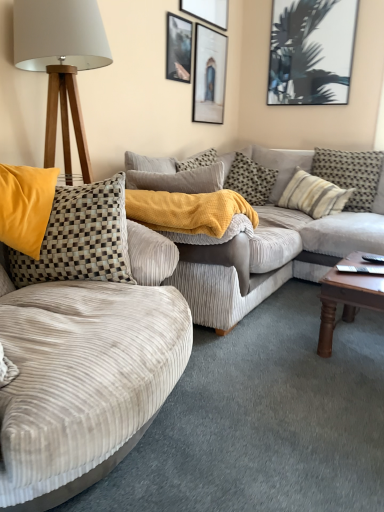
Question: Does striped fabric pillow at right, the 5th pillow from the left, have a larger size compared to striped fabric pillow at center, placed as the 4th pillow when sorted from left to right?

Choices:
 (A) yes
 (B) no

Answer: (A)

Question: From a real-world perspective, does striped fabric pillow at right, the 5th pillow from the left, sit lower than striped fabric pillow at center, which ranks as the 2th pillow in right-to-left order?

Choices:
 (A) yes
 (B) no

Answer: (B)

Question: From the image's perspective, is striped fabric pillow at right, the 5th pillow from the left, above striped fabric pillow at center, which ranks as the 2th pillow in right-to-left order?

Choices:
 (A) no
 (B) yes

Answer: (B)

Question: Is striped fabric pillow at right, the 5th pillow from the left, aimed at striped fabric pillow at center, which ranks as the 2th pillow in right-to-left order?

Choices:
 (A) yes
 (B) no

Answer: (A)

Question: Does striped fabric pillow at right, marked as the first pillow in a right-to-left arrangement, have a greater width compared to striped fabric pillow at center, placed as the 4th pillow when sorted from left to right?

Choices:
 (A) yes
 (B) no

Answer: (A)

Question: Is striped fabric pillow at right, marked as the first pillow in a right-to-left arrangement, beside striped fabric pillow at center, placed as the 4th pillow when sorted from left to right?

Choices:
 (A) yes
 (B) no

Answer: (B)

Question: Is metallic silver picture frame at upper center, the fourth picture frame viewed from the right, behind checkered fabric pillow at center, which appears as the 3th pillow when viewed from the right?

Choices:
 (A) no
 (B) yes

Answer: (A)

Question: Considering the relative sizes of metallic silver picture frame at upper center, placed as the 1th picture frame when sorted from left to right, and checkered fabric pillow at center, which ranks as the 3th pillow in left-to-right order, in the image provided, is metallic silver picture frame at upper center, placed as the 1th picture frame when sorted from left to right, thinner than checkered fabric pillow at center, which ranks as the 3th pillow in left-to-right order,?

Choices:
 (A) no
 (B) yes

Answer: (B)

Question: Is metallic silver picture frame at upper center, placed as the 1th picture frame when sorted from left to right, not within checkered fabric pillow at center, which ranks as the 3th pillow in left-to-right order?

Choices:
 (A) no
 (B) yes

Answer: (B)

Question: Is metallic silver picture frame at upper center, placed as the 1th picture frame when sorted from left to right, looking in the opposite direction of checkered fabric pillow at center, which appears as the 3th pillow when viewed from the right?

Choices:
 (A) no
 (B) yes

Answer: (A)

Question: From a real-world perspective, does metallic silver picture frame at upper center, the fourth picture frame viewed from the right, stand above checkered fabric pillow at center, which appears as the 3th pillow when viewed from the right?

Choices:
 (A) yes
 (B) no

Answer: (A)

Question: Does metallic silver picture frame at upper center, the fourth picture frame viewed from the right, have a greater height compared to checkered fabric pillow at center, which appears as the 3th pillow when viewed from the right?

Choices:
 (A) yes
 (B) no

Answer: (B)

Question: Is matte glass picture frame at upper center, the third picture frame positioned from the left, wider than wooden tripod lamp at left?

Choices:
 (A) yes
 (B) no

Answer: (B)